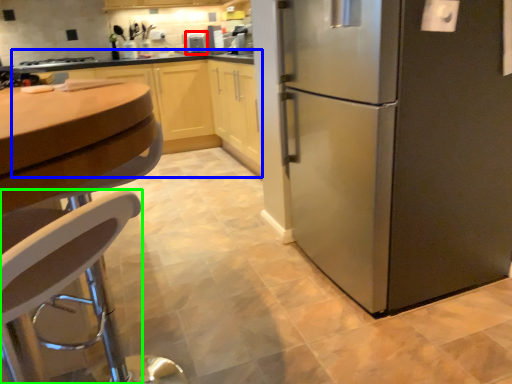
Question: Which object is positioned farthest from appliance (highlighted by a red box)? Select from cabinetry (highlighted by a blue box) and chair (highlighted by a green box).

Choices:
 (A) cabinetry
 (B) chair

Answer: (B)